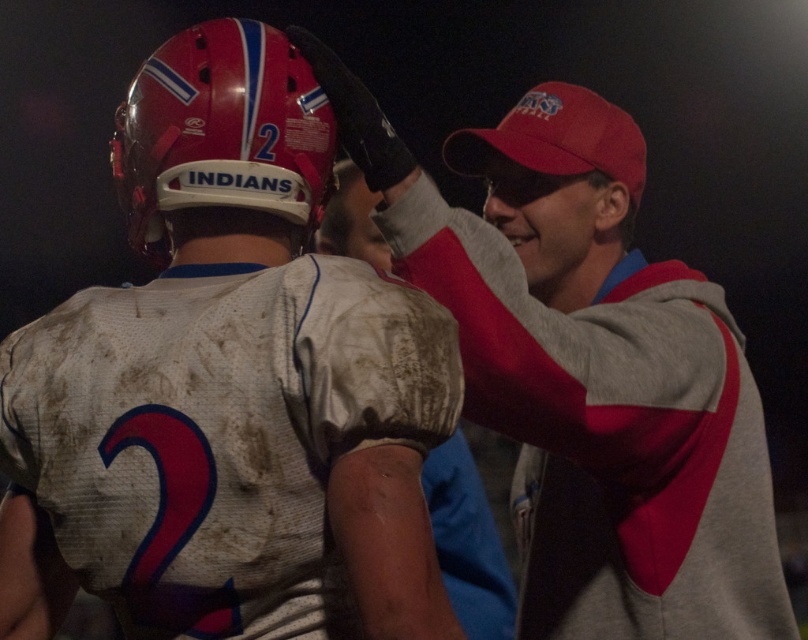
Can you confirm if matte white jersey at center is shorter than gray/red hoodie at upper right?

No, matte white jersey at center is not shorter than gray/red hoodie at upper right.

Image resolution: width=808 pixels, height=640 pixels. What are the coordinates of `matte white jersey at center` in the screenshot? It's located at (228, 387).

Does point (22, 346) come closer to viewer compared to point (452, 460)?

Yes.

The height and width of the screenshot is (640, 808). Find the location of `matte white jersey at center`. matte white jersey at center is located at coordinates point(228,387).

Does point (144, 220) come behind point (360, 186)?

No.

Between point (301, 72) and point (478, 552), which one is positioned behind?

The point (478, 552) is more distant.

Locate an element on the screen. This screenshot has height=640, width=808. matte red helmet at upper left is located at coordinates (221, 132).

Is point (607, 464) positioned after point (288, 161)?

Yes, point (607, 464) is farther from viewer.

Consider the image. Can you confirm if white matte jersey at upper right is wider than matte red helmet at upper left?

Correct, the width of white matte jersey at upper right exceeds that of matte red helmet at upper left.

This screenshot has width=808, height=640. I want to click on white matte jersey at upper right, so click(611, 436).

Where is `white matte jersey at upper right`? white matte jersey at upper right is located at coordinates (611, 436).